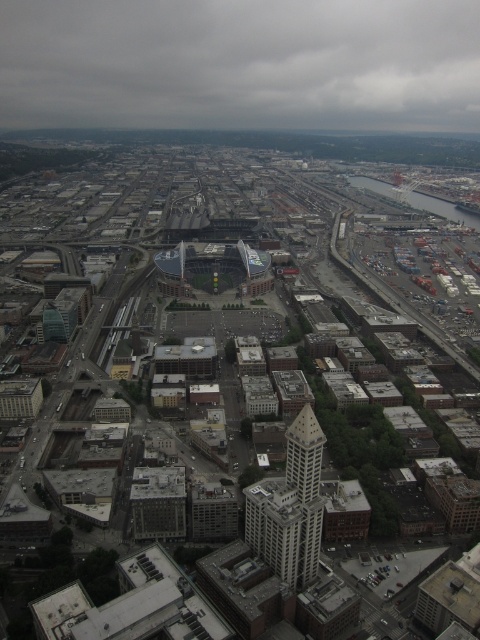
Question: Is gray cloudy sky at upper center above white stone tower at center?

Choices:
 (A) yes
 (B) no

Answer: (A)

Question: Is gray cloudy sky at upper center further to the viewer compared to white stone tower at center?

Choices:
 (A) no
 (B) yes

Answer: (B)

Question: Which of the following is the farthest from the observer?

Choices:
 (A) white stone tower at center
 (B) gray cloudy sky at upper center

Answer: (B)

Question: Does gray cloudy sky at upper center have a lesser width compared to white stone tower at center?

Choices:
 (A) yes
 (B) no

Answer: (B)